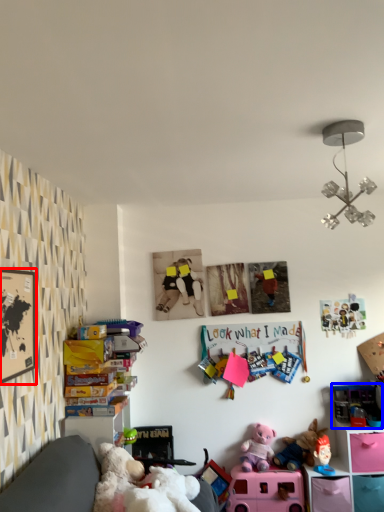
Question: Which object is further to the camera taking this photo, picture frame (highlighted by a red box) or toy (highlighted by a blue box)?

Choices:
 (A) picture frame
 (B) toy

Answer: (B)